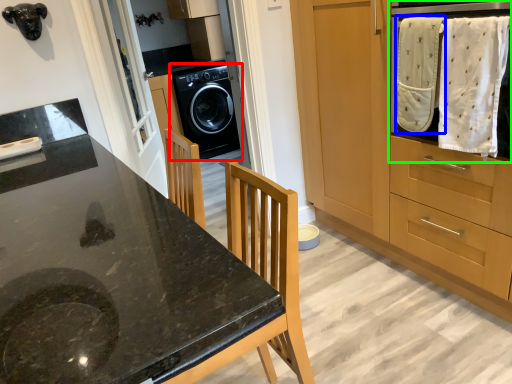
Question: Considering the real-world distances, which object is farthest from washing machine (highlighted by a red box)? baby clothe (highlighted by a blue box) or home appliance (highlighted by a green box)?

Choices:
 (A) baby clothe
 (B) home appliance

Answer: (B)